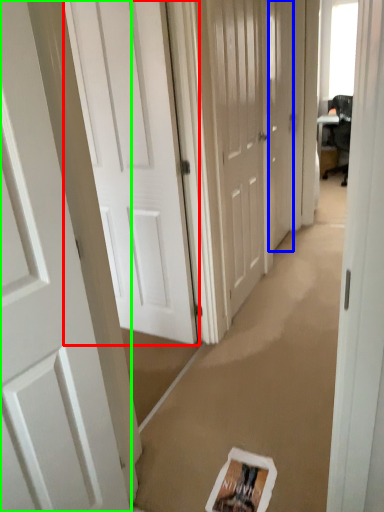
Question: Considering the real-world distances, which object is closest to door (highlighted by a red box)? door (highlighted by a blue box) or door (highlighted by a green box).

Choices:
 (A) door
 (B) door

Answer: (B)